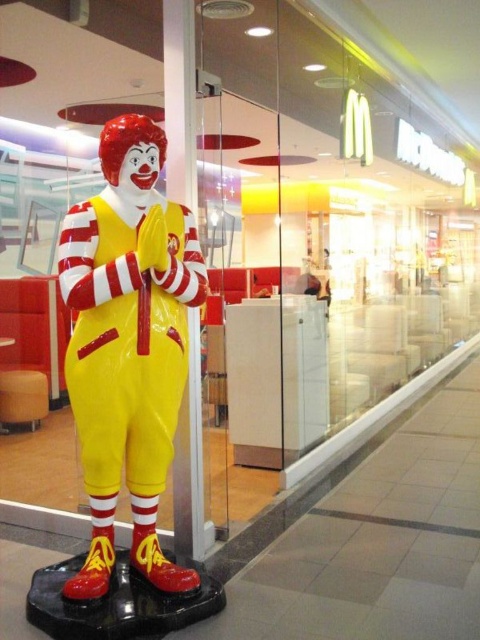
You are standing in front of the Ronald McDonald statue and want to touch the two points marked on its glass enclosure. Which point, point 1 at coordinate (x=135, y=388) or point 2 at coordinate (x=33, y=401), is closer to you?

Point 1 at coordinate (x=135, y=388) is closer to you than point 2 at coordinate (x=33, y=401).

You are a maintenance worker in the mall and need to clean the shiny plastic clown at center and the wooden stool at lower left. Which object should you clean first if you want to start from the lower position?

The wooden stool at lower left should be cleaned first because it is positioned lower than the shiny plastic clown at center, which is above it.

You are a delivery person who needs to place a small package on the black base of the Ronald McDonald statue. The statue is enclosed in glass. Can you place the package at the point with coordinates (129, 346)?

The point (129, 346) is on the shiny plastic clown at center, so you cannot place the package there because it is on the statue itself, not the base.